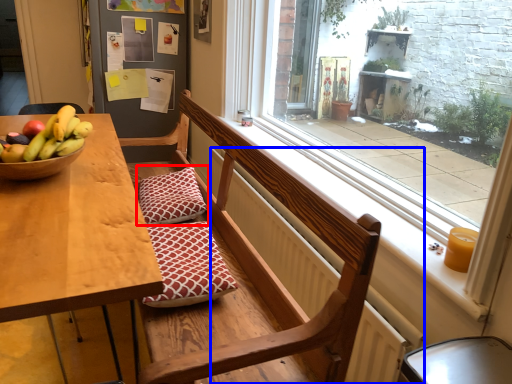
Question: Which point is further to the camera, pillow (highlighted by a red box) or radiator (highlighted by a blue box)?

Choices:
 (A) pillow
 (B) radiator

Answer: (A)